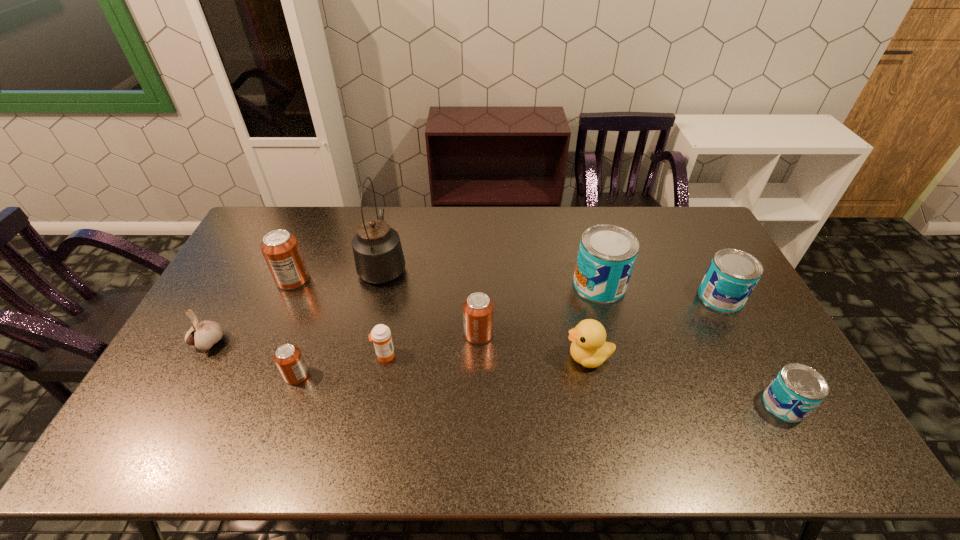
This screenshot has width=960, height=540. I want to click on the leftmost object, so click(x=203, y=335).

Find the location of `the fifth farthest can`. the fifth farthest can is located at coordinates (288, 358).

Locate an element on the screen. The height and width of the screenshot is (540, 960). the second orange can from left to right is located at coordinates (288, 358).

The height and width of the screenshot is (540, 960). In order to click on the nearest object in this screenshot , I will do `click(797, 389)`.

Where is `the smallest blue can`? This screenshot has height=540, width=960. the smallest blue can is located at coordinates (797, 389).

Locate an element on the screen. This screenshot has height=540, width=960. free spot located spout on the tallest object is located at coordinates [393, 223].

I want to click on vacant space positioned 0.140m spout on the tallest object, so click(x=394, y=220).

Locate an element on the screen. free region located spout on the tallest object is located at coordinates (395, 215).

Find the location of `free region located on the left of the leftmost blue can`. free region located on the left of the leftmost blue can is located at coordinates (531, 284).

Locate an element on the screen. Image resolution: width=960 pixels, height=540 pixels. free spot located on the back of the leftmost orange can is located at coordinates (306, 249).